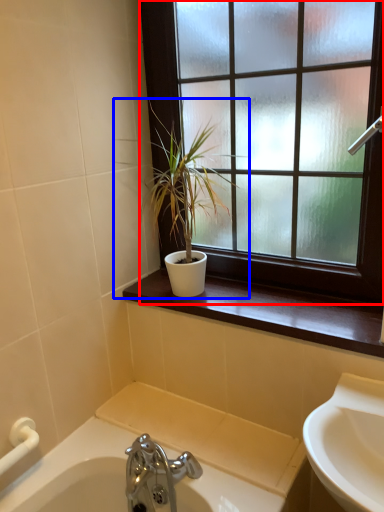
Question: Among these objects, which one is nearest to the camera, window (highlighted by a red box) or houseplant (highlighted by a blue box)?

Choices:
 (A) window
 (B) houseplant

Answer: (A)